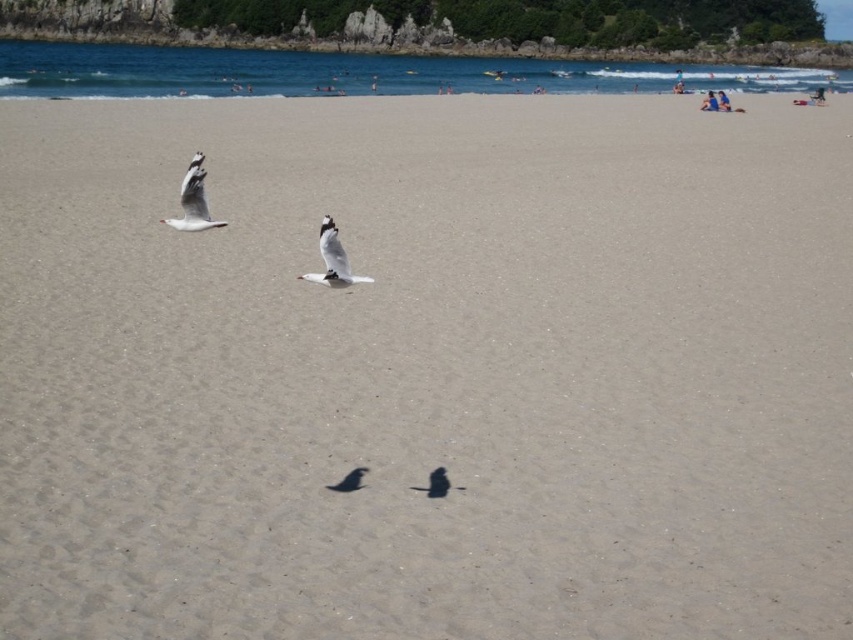
Question: Is white matte seagull at upper left below white matte seagull at center?

Choices:
 (A) yes
 (B) no

Answer: (B)

Question: Among these points, which one is nearest to the camera?

Choices:
 (A) (200, 179)
 (B) (318, 234)

Answer: (B)

Question: Does white matte seagull at upper left have a larger size compared to white matte bird at center?

Choices:
 (A) no
 (B) yes

Answer: (B)

Question: Does white feathered bird at center have a greater width compared to white matte bird at center?

Choices:
 (A) no
 (B) yes

Answer: (A)

Question: Which point appears closest to the camera in this image?

Choices:
 (A) (357, 276)
 (B) (436, 472)

Answer: (A)

Question: Considering the real-world distances, which object is farthest from the white matte bird at center?

Choices:
 (A) white matte seagull at center
 (B) white matte seagull at upper left

Answer: (B)